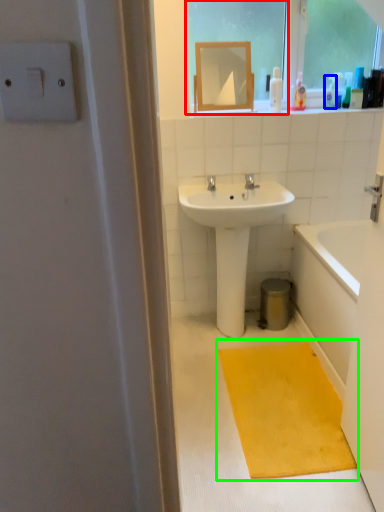
Question: Which is farther away from window screen (highlighted by a red box)? toiletry (highlighted by a blue box) or doormat (highlighted by a green box)?

Choices:
 (A) toiletry
 (B) doormat

Answer: (B)